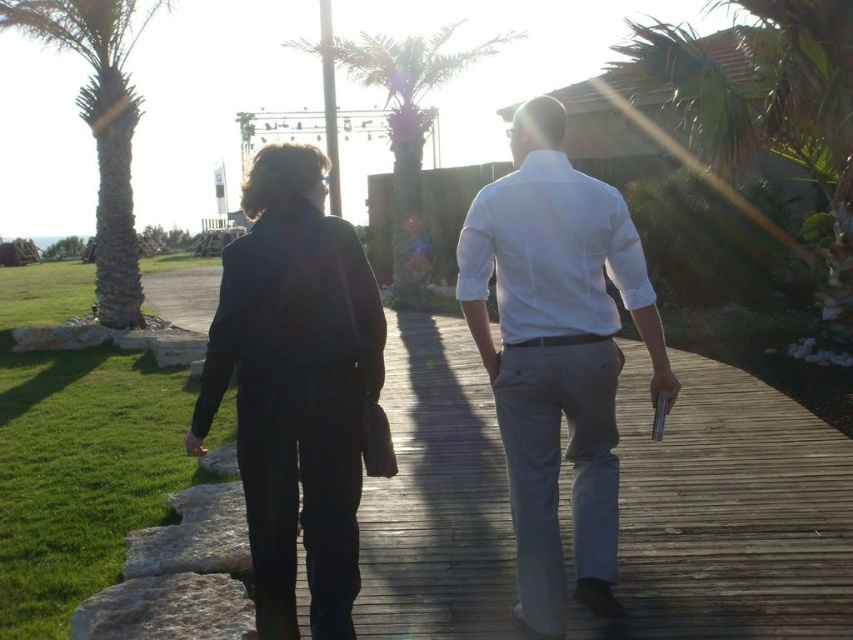
You are standing at the point closer to the viewer in the image. Which point are you at, point (560, 349) or point (79, 113)?

You are at point (560, 349) because it is closer to the viewer than point (79, 113).